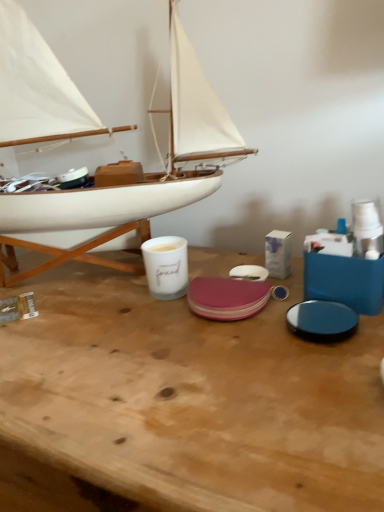
What are the coordinates of `free spot below white wood boat at left (from a real-world perspective)` in the screenshot? It's located at (87, 278).